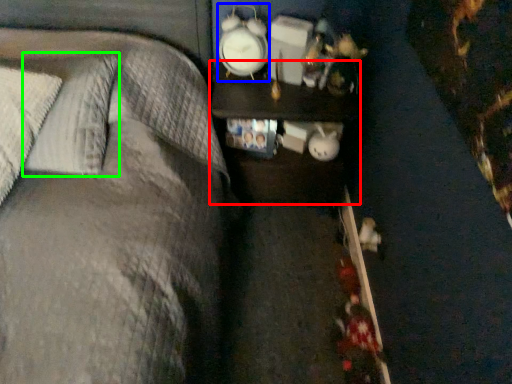
Question: Based on their relative distances, which object is nearer to nightstand (highlighted by a red box)? Choose from clock (highlighted by a blue box) and pillow (highlighted by a green box).

Choices:
 (A) clock
 (B) pillow

Answer: (A)